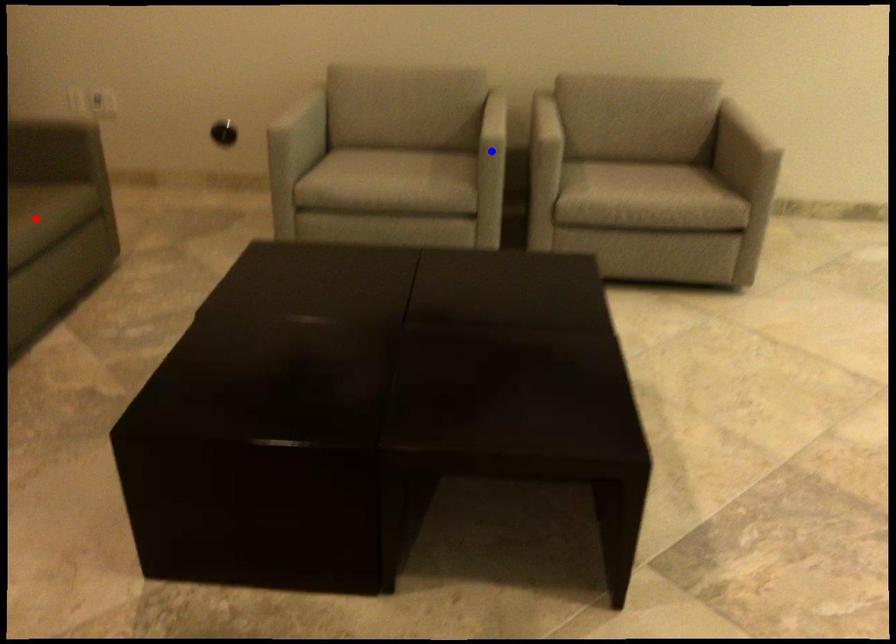
Question: Two points are marked on the image. Which point is closer to the camera?

Choices:
 (A) Blue point is closer.
 (B) Red point is closer.

Answer: (B)